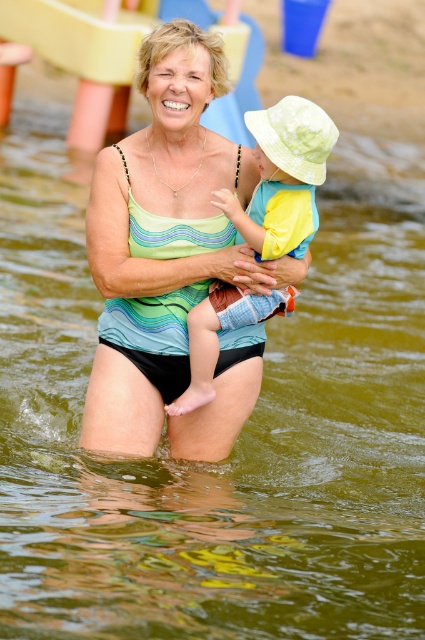
You are a photographer trying to capture a candid shot of the woman and child in the water park scene. The woman is wearing a matte green tank top at center and light blue denim shorts at center. Which piece of clothing is closer to the camera?

The matte green tank top at center is positioned under the light blue denim shorts at center, so the tank top is closer to the camera since it is underneath the shorts.

You are a swim instructor observing a parent and child in the water. The parent is wearing a matte green tank top at center and the child has light blue denim shorts at center. If you need to hand them a life jacket that fits both, which clothing item should you consider the width of to ensure the jacket fits comfortably?

You should consider the width of the matte green tank top at center because it might be wider than the light blue denim shorts at center, so the life jacket should be sized to accommodate the wider item.

You are a lifeguard at the water park and need to ensure safety. The woman in the water is wearing a matte green tank top at center and light blue denim shorts at center. Are the distance between these two clothing items on her body within the standard safety distance required for quick access to emergency equipment? Please state your conclusion based on the given distance.

The distance between the matte green tank top at center and light blue denim shorts at center is 35.31 centimeters. Since standard safety guidelines recommend a minimum of 30 centimeters for quick access to emergency equipment, the distance is sufficient.